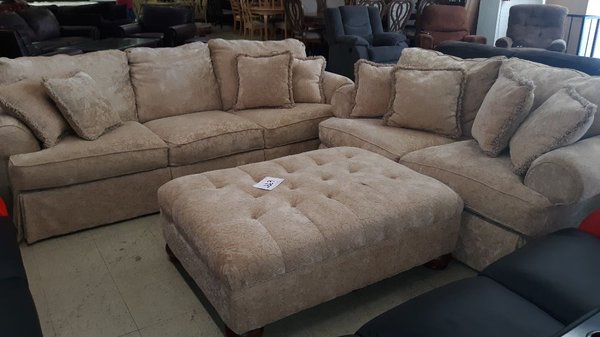
Find the location of a particular element. The height and width of the screenshot is (337, 600). red chair is located at coordinates point(444,22).